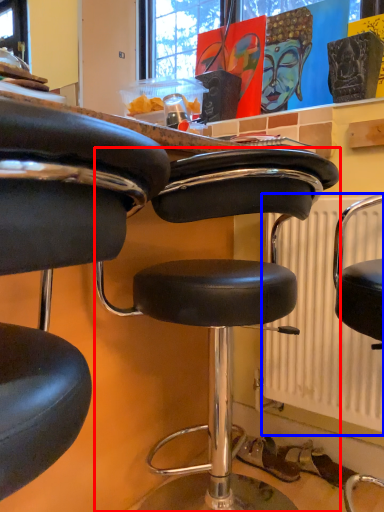
Question: Which point is further to the camera, chair (highlighted by a red box) or radiator (highlighted by a blue box)?

Choices:
 (A) chair
 (B) radiator

Answer: (A)